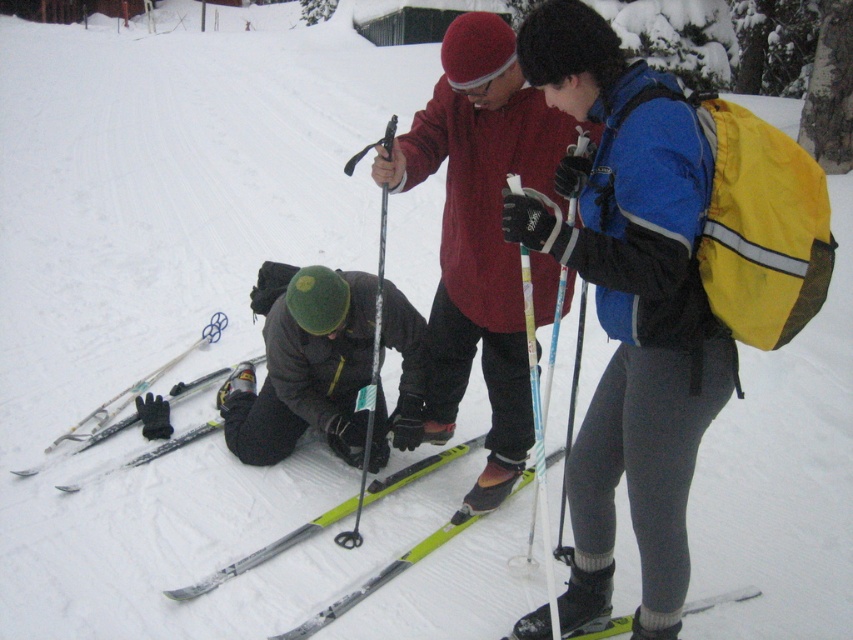
You are a winter traveler who just arrived at the snowy area. You need to retrieve your yellow backpack at center and your yellow matte ski at lower center. Are these items close enough to each other so you can easily pick them up without walking too far?

The yellow backpack at center and yellow matte ski at lower center are 38.27 inches apart, which is approximately 3.19 feet. Since this distance is relatively short, you can easily pick up both items without needing to walk a long distance.